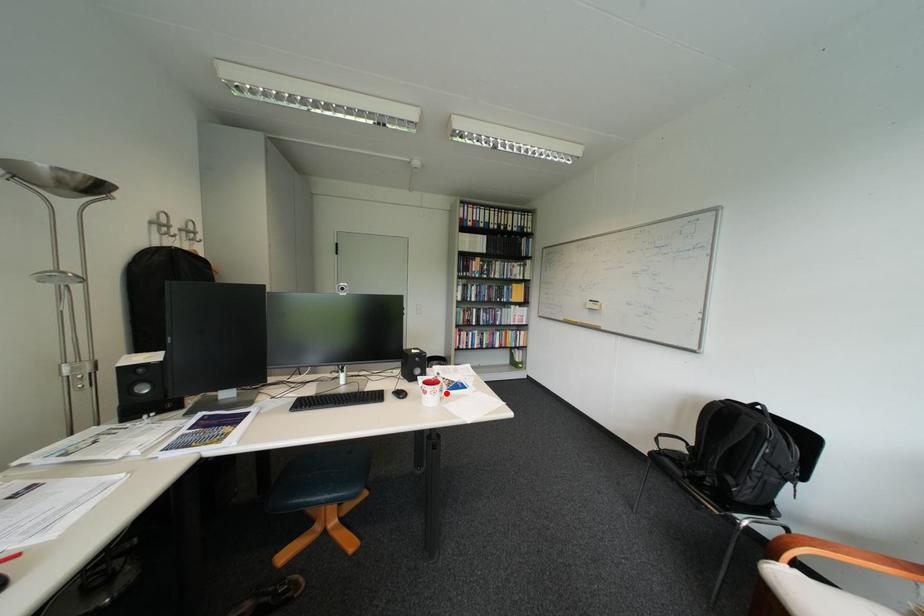
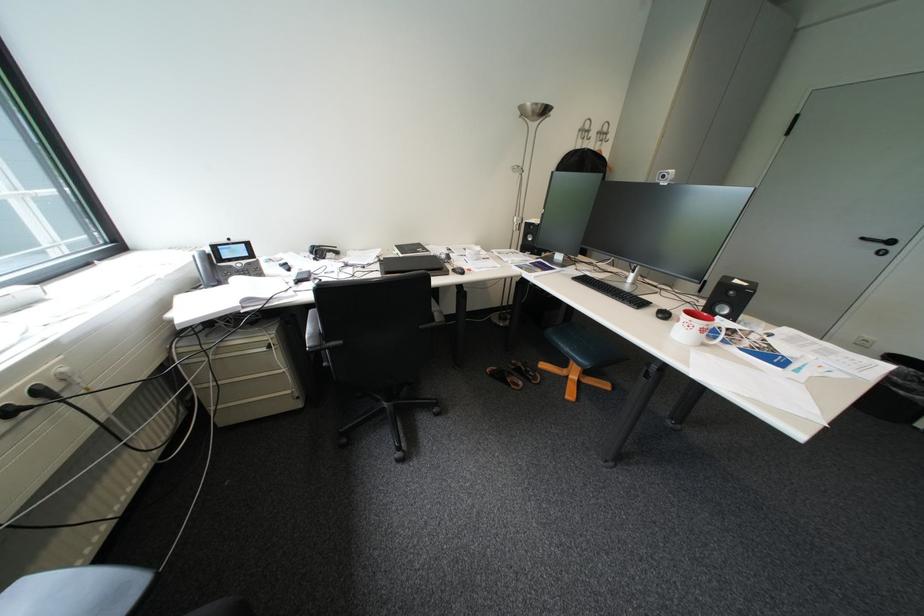
The point at the highlighted location is marked in the first image. Where is the corresponding point in the second image?

(700, 326)